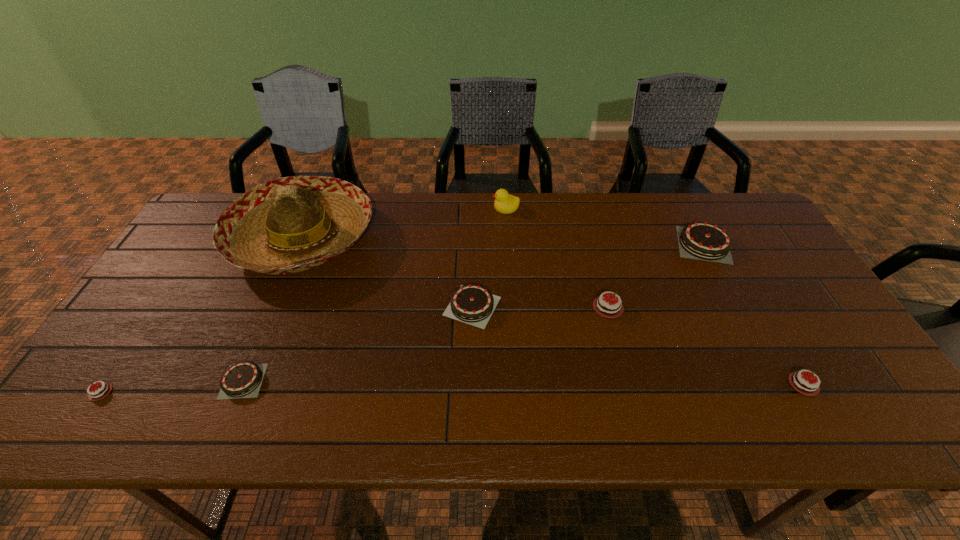
At what (x,y) coordinates should I click in order to perform the action: click on object that is at the far left corner. Please return your answer as a coordinate pair (x, y). Image resolution: width=960 pixels, height=540 pixels. Looking at the image, I should click on (291, 224).

This screenshot has height=540, width=960. I want to click on object present at the near left corner, so click(x=100, y=392).

In order to click on object at the far right corner in this screenshot , I will do `click(702, 240)`.

Identify the location of object that is at the near right corner. (807, 385).

The width and height of the screenshot is (960, 540). I want to click on free location at the far edge of the desktop, so point(470,214).

In the image, there is a desktop. Where is `free space at the near edge`? Image resolution: width=960 pixels, height=540 pixels. free space at the near edge is located at coordinates click(816, 429).

Locate an element on the screen. This screenshot has height=540, width=960. vacant space at the left edge is located at coordinates pos(180,324).

Image resolution: width=960 pixels, height=540 pixels. I want to click on vacant space at the right edge of the desktop, so click(848, 362).

At what (x,y) coordinates should I click in order to perform the action: click on vacant space at the far left corner. Please return your answer as a coordinate pair (x, y). Image resolution: width=960 pixels, height=540 pixels. Looking at the image, I should click on (206, 218).

Identify the location of vacant space at the near left corner of the desktop. The image size is (960, 540). (110, 408).